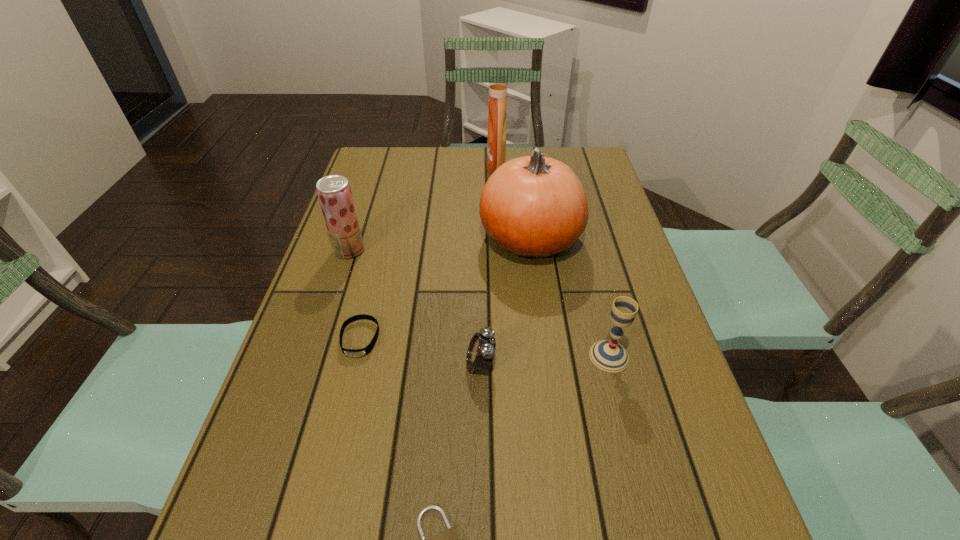
The width and height of the screenshot is (960, 540). I want to click on wristband that is positioned at the left edge, so click(x=364, y=351).

Find the location of a particular element. This screenshot has width=960, height=540. pumpkin at the right edge is located at coordinates (533, 206).

Locate an element on the screen. Image resolution: width=960 pixels, height=540 pixels. chalice located at the right edge is located at coordinates (608, 355).

At what (x,y) coordinates should I click in order to perform the action: click on free space at the far edge. Please return your answer as a coordinate pair (x, y). The image size is (960, 540). Looking at the image, I should click on (481, 163).

The height and width of the screenshot is (540, 960). In order to click on free space at the left edge of the desktop in this screenshot , I will do click(x=293, y=488).

This screenshot has width=960, height=540. In the image, there is a desktop. Identify the location of vacant space at the right edge. (682, 407).

At what (x,y) coordinates should I click in order to perform the action: click on vacant space at the far right corner of the desktop. Please return your answer as a coordinate pair (x, y). The height and width of the screenshot is (540, 960). Looking at the image, I should click on (579, 155).

The width and height of the screenshot is (960, 540). Find the location of `free space between the farthest object and the sixth object from right to left`. free space between the farthest object and the sixth object from right to left is located at coordinates (428, 253).

Locate an element on the screen. free spot between the wristband and the fifth shortest object is located at coordinates (354, 294).

Where is `vacant region between the fifth tallest object and the sixth tallest object`? The image size is (960, 540). vacant region between the fifth tallest object and the sixth tallest object is located at coordinates (420, 351).